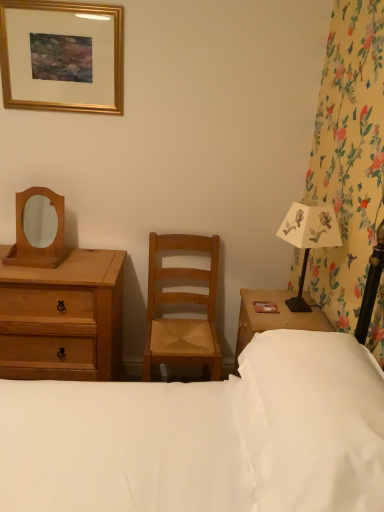
Question: Does natural wood chair at center lie behind white soft pillow at lower right?

Choices:
 (A) no
 (B) yes

Answer: (B)

Question: From a real-world perspective, is natural wood chair at center located beneath white soft pillow at lower right?

Choices:
 (A) no
 (B) yes

Answer: (B)

Question: Is natural wood chair at center with white soft pillow at lower right?

Choices:
 (A) no
 (B) yes

Answer: (A)

Question: Is natural wood chair at center shorter than white soft pillow at lower right?

Choices:
 (A) yes
 (B) no

Answer: (B)

Question: Would you say natural wood chair at center contains white soft pillow at lower right?

Choices:
 (A) no
 (B) yes

Answer: (A)

Question: Can you confirm if natural wood chair at center is smaller than white soft pillow at lower right?

Choices:
 (A) no
 (B) yes

Answer: (A)

Question: Considering the relative sizes of white fabric bed at center and natural wood chair at center in the image provided, is white fabric bed at center shorter than natural wood chair at center?

Choices:
 (A) no
 (B) yes

Answer: (B)

Question: Is natural wood chair at center at the back of white fabric bed at center?

Choices:
 (A) no
 (B) yes

Answer: (A)

Question: Considering the relative positions of white fabric bed at center and natural wood chair at center in the image provided, is white fabric bed at center to the right of natural wood chair at center from the viewer's perspective?

Choices:
 (A) no
 (B) yes

Answer: (A)

Question: Would you consider white fabric bed at center to be distant from natural wood chair at center?

Choices:
 (A) no
 (B) yes

Answer: (A)

Question: From the image's perspective, would you say white fabric bed at center is shown under natural wood chair at center?

Choices:
 (A) yes
 (B) no

Answer: (B)

Question: From a real-world perspective, is white fabric bed at center over natural wood chair at center?

Choices:
 (A) yes
 (B) no

Answer: (A)

Question: Is gold wooden picture frame at upper left touching light brown wooden chest of drawers at left?

Choices:
 (A) no
 (B) yes

Answer: (A)